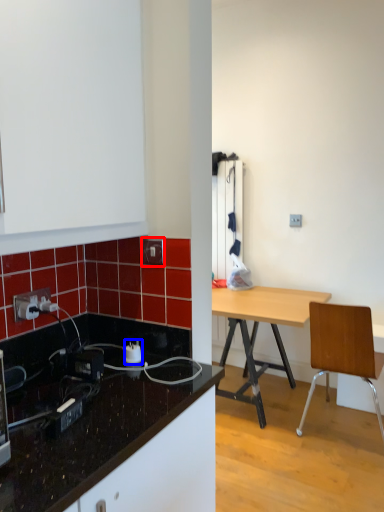
Question: Among these objects, which one is farthest to the camera, electric outlet (highlighted by a red box) or power plugs and sockets (highlighted by a blue box)?

Choices:
 (A) electric outlet
 (B) power plugs and sockets

Answer: (A)